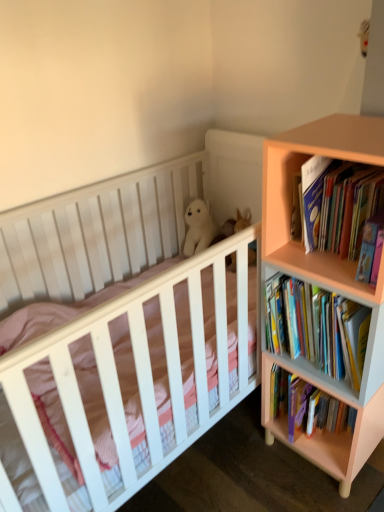
What is the approximate width of pink matte bookcase at right?

15.52 inches.

Find the location of `hardcover book at right, which is the 1th book in top-to-bottom order`. hardcover book at right, which is the 1th book in top-to-bottom order is located at coordinates pyautogui.click(x=338, y=205).

Which is more to the right, hardcover book at right, which is the second book in bottom-to-top order, or hardcover books at right, the second book from the top?

hardcover books at right, the second book from the top, is more to the right.

Is hardcover book at right, which is the second book in bottom-to-top order, thinner than hardcover books at right, placed as the 1th book when sorted from bottom to top?

Yes.

This screenshot has height=512, width=384. I want to click on book on the left of hardcover books at right, placed as the 1th book when sorted from bottom to top, so click(338, 205).

Can you confirm if pink matte bookcase at right is wider than white plush bear at center?

Yes.

Is pink matte bookcase at right not close to white plush bear at center?

Actually, pink matte bookcase at right and white plush bear at center are a little close together.

Locate an element on the screen. figurine lying behind the pink matte bookcase at right is located at coordinates (198, 227).

Based on the photo, which object is positioned more to the right, white matte crib at center or pink matte bookcase at right?

From the viewer's perspective, pink matte bookcase at right appears more on the right side.

Could you tell me if white matte crib at center is turned towards pink matte bookcase at right?

Yes, white matte crib at center is aimed at pink matte bookcase at right.

From the image's perspective, is white matte crib at center positioned above or below pink matte bookcase at right?

Based on their image positions, white matte crib at center is located beneath pink matte bookcase at right.

Is white plush bear at upper center not close to hardcover book at right, which is the 1th book in top-to-bottom order?

They are positioned close to each other.

Can you confirm if white plush bear at upper center is smaller than hardcover book at right, which is the 1th book in top-to-bottom order?

Indeed, white plush bear at upper center has a smaller size compared to hardcover book at right, which is the 1th book in top-to-bottom order.

Is hardcover book at right, which is the 1th book in top-to-bottom order, at the back of white plush bear at upper center?

white plush bear at upper center does not have its back to hardcover book at right, which is the 1th book in top-to-bottom order.

Is white matte crib at center thinner than hardcover book at right, which is the 1th book in top-to-bottom order?

No.

Measure the distance between white matte crib at center and hardcover book at right, which is the 1th book in top-to-bottom order.

They are 22.30 inches apart.

Which point is more forward, (46, 505) or (310, 162)?

The point (46, 505) is closer.

Which is behind, white matte crib at center or hardcover book at right, which is the 1th book in top-to-bottom order?

hardcover book at right, which is the 1th book in top-to-bottom order, is behind.

Does hardcover book at right, which is the second book in bottom-to-top order, turn towards white plush bear at center?

No, hardcover book at right, which is the second book in bottom-to-top order, does not turn towards white plush bear at center.

Is hardcover book at right, which is the second book in bottom-to-top order, inside the boundaries of white plush bear at center, or outside?

hardcover book at right, which is the second book in bottom-to-top order, is located beyond the bounds of white plush bear at center.

Which is behind, point (309, 170) or point (189, 244)?

The point (189, 244) is farther from the camera.

Considering the sizes of hardcover book at right, which is the 1th book in top-to-bottom order, and white plush bear at center in the image, is hardcover book at right, which is the 1th book in top-to-bottom order, taller or shorter than white plush bear at center?

Considering their sizes, hardcover book at right, which is the 1th book in top-to-bottom order, has more height than white plush bear at center.

Relative to hardcover book at right, which is the 1th book in top-to-bottom order, is pink matte bookcase at right in front or behind?

pink matte bookcase at right is in front of hardcover book at right, which is the 1th book in top-to-bottom order.

Is pink matte bookcase at right located outside hardcover book at right, which is the 1th book in top-to-bottom order?

Yes, pink matte bookcase at right is located beyond the bounds of hardcover book at right, which is the 1th book in top-to-bottom order.

From the image's perspective, which one is positioned higher, pink matte bookcase at right or hardcover book at right, which is the second book in bottom-to-top order?

hardcover book at right, which is the second book in bottom-to-top order, is shown above in the image.

From a real-world perspective, between pink matte bookcase at right and hardcover book at right, which is the second book in bottom-to-top order, who is vertically lower?

pink matte bookcase at right is physically lower.

Identify the location of book on the left of the hardcover books at right, placed as the 1th book when sorted from bottom to top. The image size is (384, 512). (338, 205).

Locate an element on the screen. bookcase that is above the white plush bear at center (from a real-world perspective) is located at coordinates (325, 288).

Based on their spatial positions, is white plush bear at upper center or white matte crib at center closer to hardcover books at right, the second book from the top?

white matte crib at center lies closer to hardcover books at right, the second book from the top, than the other object.

Considering their positions, is hardcover book at right, which is the 1th book in top-to-bottom order, positioned further to pink matte bookcase at right than white plush bear at center?

Among the two, white plush bear at center is located further to pink matte bookcase at right.

Considering their positions, is hardcover books at right, placed as the 1th book when sorted from bottom to top, positioned closer to white plush bear at center than white matte crib at center?

The object closer to white plush bear at center is white matte crib at center.

From the picture: When comparing their distances from white plush bear at upper center, does hardcover book at right, which is the 1th book in top-to-bottom order, or white plush bear at center seem further?

Among the two, hardcover book at right, which is the 1th book in top-to-bottom order, is located further to white plush bear at upper center.

Looking at the image, which one is located closer to white plush bear at center, white plush bear at upper center or pink matte bookcase at right?

white plush bear at upper center.

Considering their positions, is white plush bear at upper center positioned closer to pink matte bookcase at right than hardcover books at right, the second book from the top?

Among the two, hardcover books at right, the second book from the top, is located nearer to pink matte bookcase at right.

Which object lies further to the anchor point white plush bear at upper center, pink matte bookcase at right or hardcover book at right, which is the second book in bottom-to-top order?

pink matte bookcase at right.

Based on their spatial positions, is white plush bear at upper center or pink matte bookcase at right closer to hardcover book at right, which is the 1th book in top-to-bottom order?

Based on the image, pink matte bookcase at right appears to be nearer to hardcover book at right, which is the 1th book in top-to-bottom order.

I want to click on book between hardcover book at right, which is the second book in bottom-to-top order, and white plush bear at center in the front-back direction, so click(x=316, y=327).

What are the coordinates of `toy between white matte crib at center and white plush bear at center in the front-back direction` in the screenshot? It's located at (234, 226).

At what (x,y) coordinates should I click in order to perform the action: click on book between white matte crib at center and hardcover books at right, placed as the 1th book when sorted from bottom to top. Please return your answer as a coordinate pair (x, y). The width and height of the screenshot is (384, 512). Looking at the image, I should click on (338, 205).

Where is `bookcase between white matte crib at center and white plush bear at center along the z-axis`? The width and height of the screenshot is (384, 512). bookcase between white matte crib at center and white plush bear at center along the z-axis is located at coordinates (325, 288).